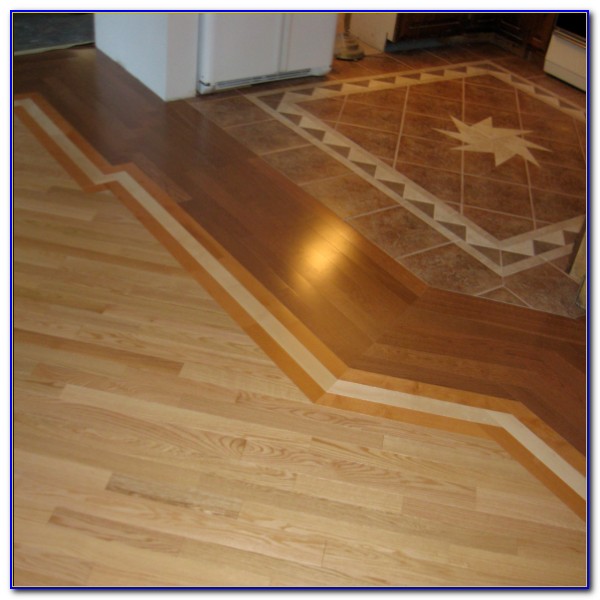
Find the location of a particular element. white appliance is located at coordinates (232, 62).